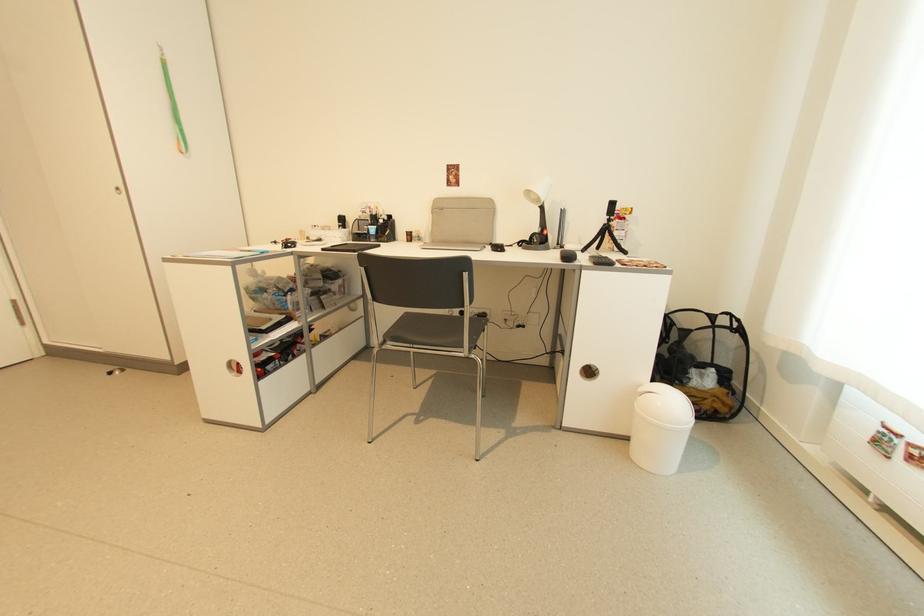
At ([662,395], what is located there?

This point indicates the trash can lid.